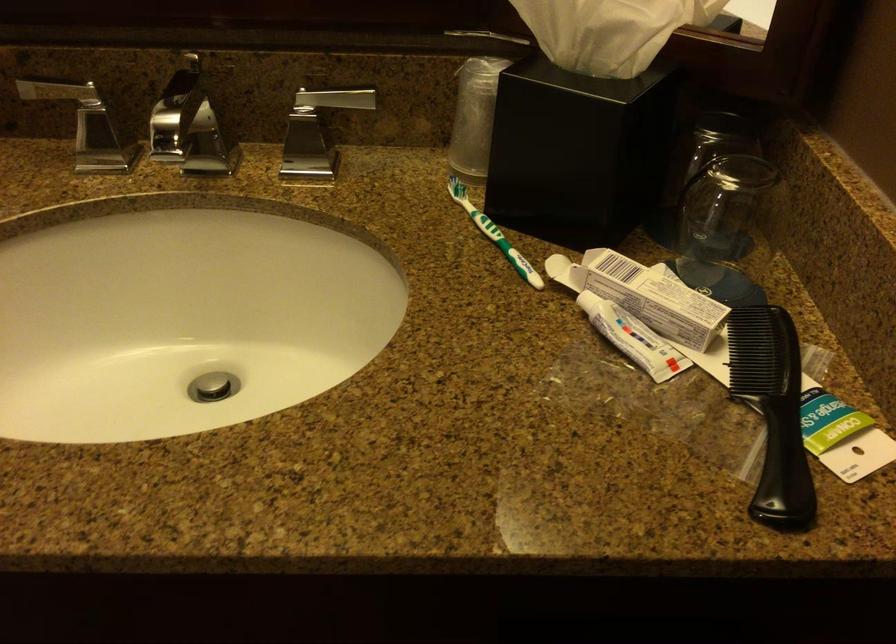
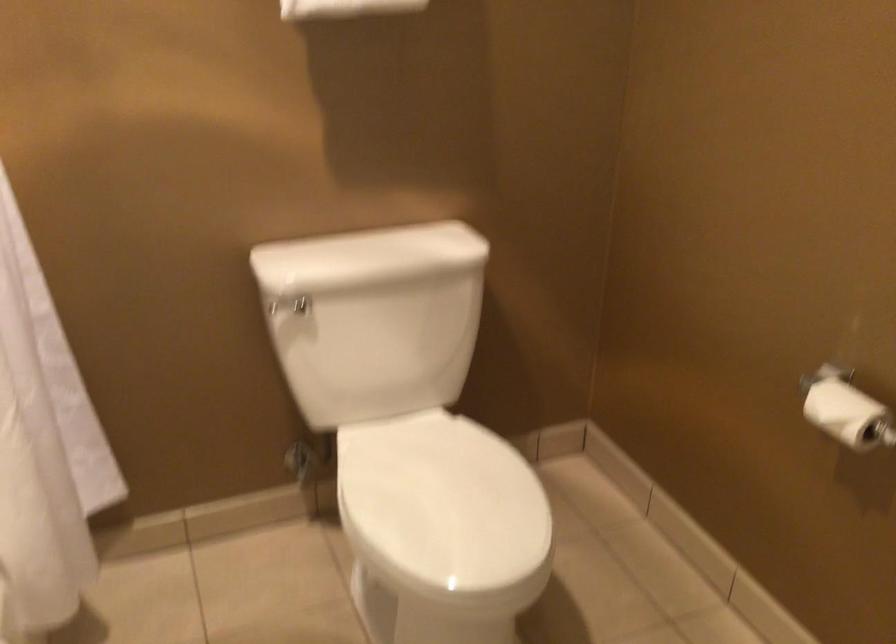
Question: The camera is either moving clockwise (left) or counter-clockwise (right) around the object. The first image is from the beginning of the video and the second image is from the end. Is the camera moving left or right when shooting the video?

Choices:
 (A) Left
 (B) Right

Answer: (B)